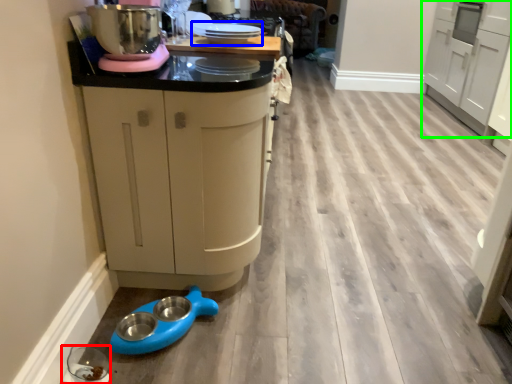
Question: Which object is the farthest from appliance (highlighted by a red box)? Choose among these: appliance (highlighted by a blue box) or cabinetry (highlighted by a green box).

Choices:
 (A) appliance
 (B) cabinetry

Answer: (B)